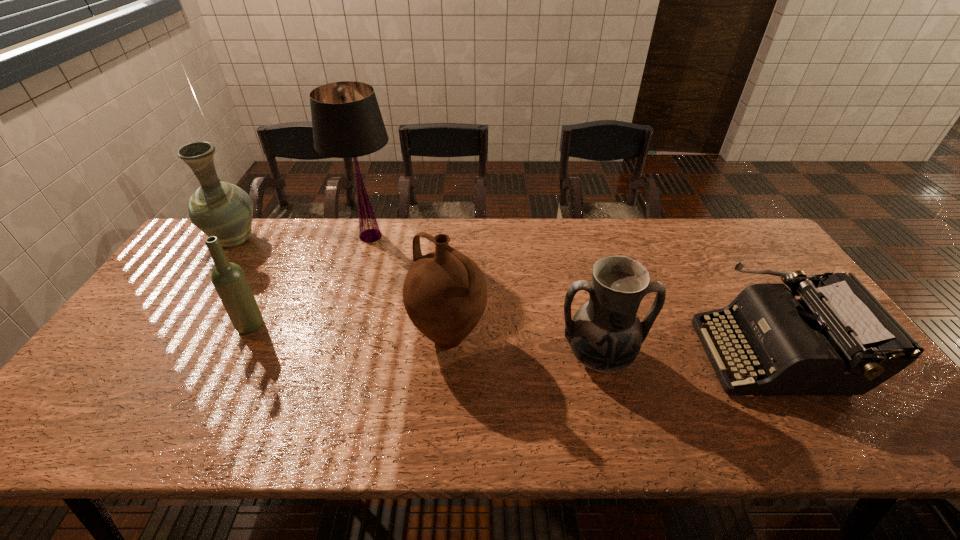
You are a GUI agent. You are given a task and a screenshot of the screen. Output one action in this format:
    pyautogui.click(x=<x>, y=<y>)
    Task: Click on the pitcher identified as the second closest to the third object from right to left
    The image size is (960, 540).
    Given the screenshot: What is the action you would take?
    pyautogui.click(x=217, y=208)

Point out which pitcher is positioned as the nearest to the leftmost pitcher. Please provide its 2D coordinates. Your answer should be formatted as a tuple, i.e. [(x, y)], where the tuple contains the x and y coordinates of a point satisfying the conditions above.

[(445, 293)]

You are a GUI agent. You are given a task and a screenshot of the screen. Output one action in this format:
    pyautogui.click(x=<x>, y=<y>)
    Task: Click on the vacant region that satisfies the following two spatial constraints: 1. on the front-facing side of the lampshade; 2. on the left side of the second pitcher from right to left
    The image size is (960, 540).
    Given the screenshot: What is the action you would take?
    pyautogui.click(x=340, y=337)

The width and height of the screenshot is (960, 540). Find the location of `free space that satisfies the following two spatial constraints: 1. on the front-facing side of the lampshade; 2. on the left side of the second pitcher from left to right`. free space that satisfies the following two spatial constraints: 1. on the front-facing side of the lampshade; 2. on the left side of the second pitcher from left to right is located at coordinates (340, 337).